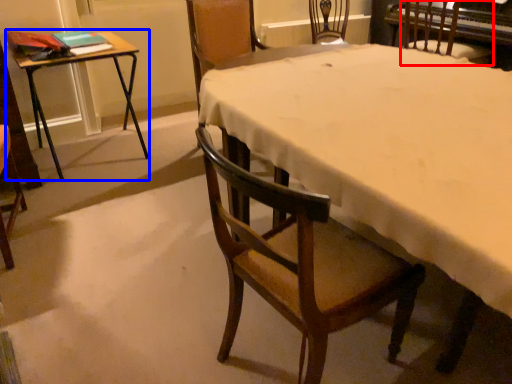
Question: Among these objects, which one is farthest to the camera, chair (highlighted by a red box) or table (highlighted by a blue box)?

Choices:
 (A) chair
 (B) table

Answer: (A)